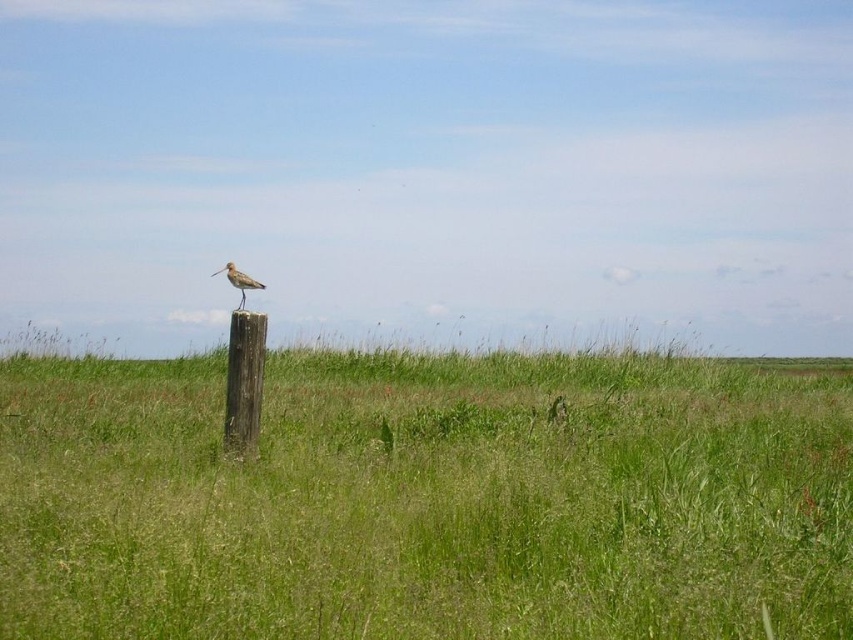
You are a photographer trying to capture a closeup of the brown speckled feathered bird at center. Given that the green grassy field at center is in the way, can you adjust your camera angle to focus on the bird without the field blocking the view?

The green grassy field at center is larger than the brown speckled feathered bird at center, so adjusting the camera angle to focus on the bird while minimizing the field in the frame is possible by zooming in or moving closer to the bird.

You are a photographer standing at the edge of the green grassy field at center and want to take a photo of the brown wooden post at center. Since you want the post to be the main focus, which object should you ensure is closer to the camera to achieve this?

To make the brown wooden post at center the main focus, you should ensure the brown wooden post at center is closer to the camera than the green grassy field at center, as the green grassy field at center is in front of the brown wooden post at center.